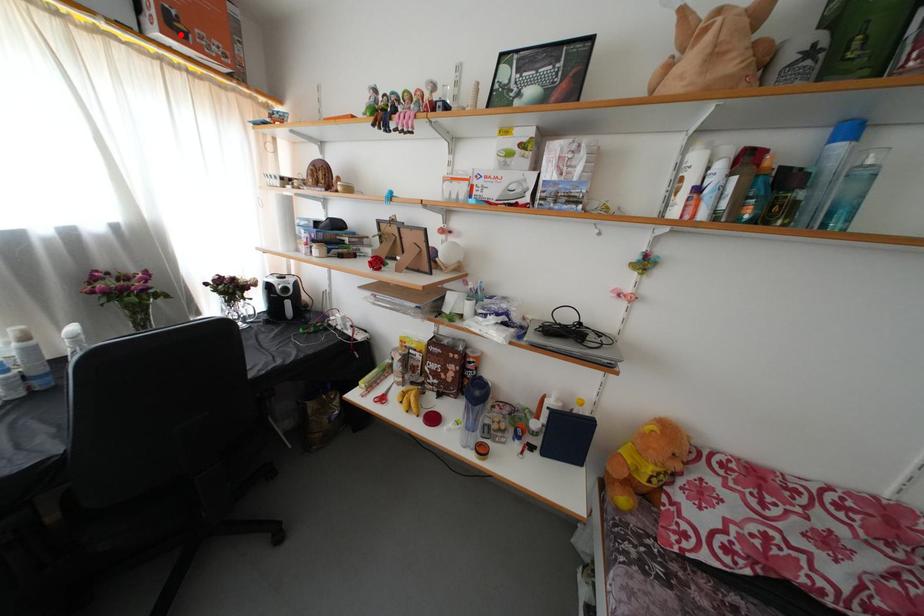
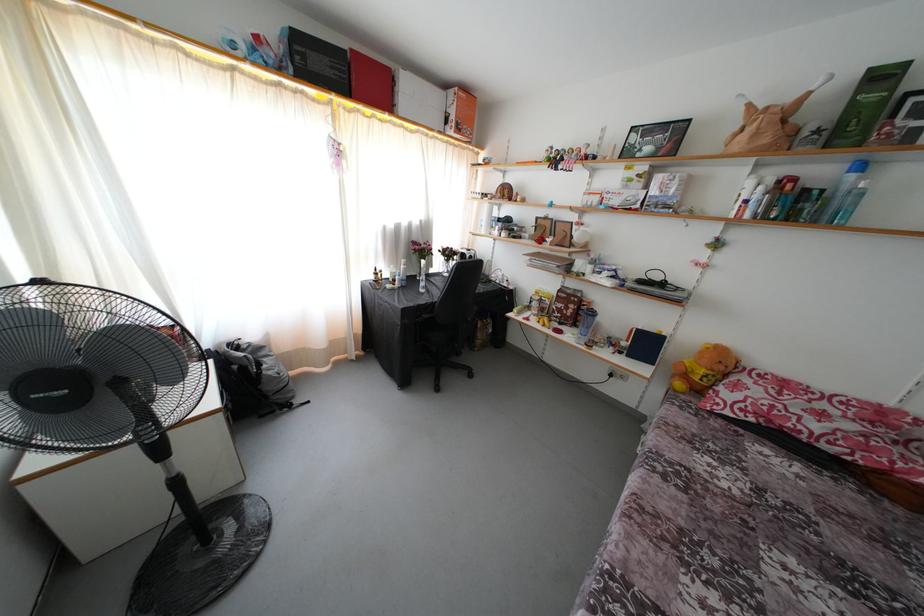
Question: I am providing you with two images of the same scene from different viewpoints. A red point is shown in image1. For the corresponding object point in image2, is it positioned nearer or farther from the camera?

Choices:
 (A) Nearer
 (B) Farther

Answer: (A)